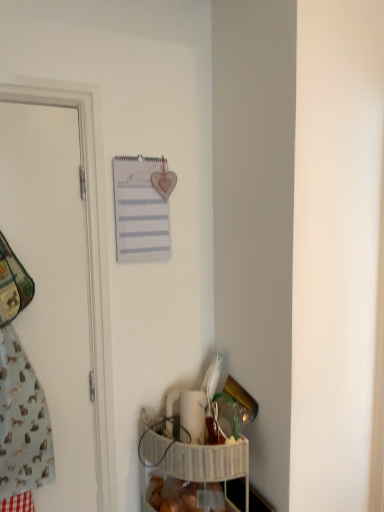
Question: Considering the relative sizes of white matte door at left and white woven basket at lower right in the image provided, is white matte door at left bigger than white woven basket at lower right?

Choices:
 (A) no
 (B) yes

Answer: (A)

Question: Does white matte door at left turn towards white woven basket at lower right?

Choices:
 (A) yes
 (B) no

Answer: (B)

Question: From the image's perspective, does white matte door at left appear higher than white woven basket at lower right?

Choices:
 (A) yes
 (B) no

Answer: (A)

Question: Does white matte door at left touch white woven basket at lower right?

Choices:
 (A) yes
 (B) no

Answer: (B)

Question: From the image's perspective, is white matte door at left below white woven basket at lower right?

Choices:
 (A) no
 (B) yes

Answer: (A)

Question: Is white woven basket at lower right surrounded by white matte door at left?

Choices:
 (A) no
 (B) yes

Answer: (A)

Question: From a real-world perspective, is white paper journal at upper center physically above light blue fabric at left?

Choices:
 (A) yes
 (B) no

Answer: (A)

Question: Is white paper journal at upper center taller than light blue fabric at left?

Choices:
 (A) no
 (B) yes

Answer: (A)

Question: Can you confirm if white paper journal at upper center is wider than light blue fabric at left?

Choices:
 (A) yes
 (B) no

Answer: (B)

Question: Considering the relative sizes of white paper journal at upper center and light blue fabric at left in the image provided, is white paper journal at upper center shorter than light blue fabric at left?

Choices:
 (A) no
 (B) yes

Answer: (B)

Question: Is white paper journal at upper center at the left side of light blue fabric at left?

Choices:
 (A) yes
 (B) no

Answer: (B)

Question: Is white paper journal at upper center outside of light blue fabric at left?

Choices:
 (A) yes
 (B) no

Answer: (A)

Question: Would you say white woven basket at lower right is a long distance from white matte door at left?

Choices:
 (A) no
 (B) yes

Answer: (A)